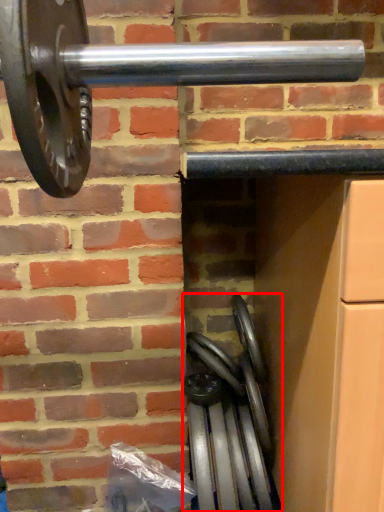
Question: From the image's perspective, where is wheel (annotated by the red box) located in relation to wheel in the image?

Choices:
 (A) below
 (B) above

Answer: (A)